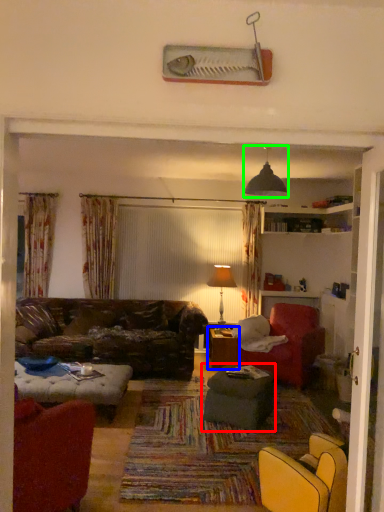
Question: Considering the real-world distances, which object is closest to table (highlighted by a red box)? table (highlighted by a blue box) or light fixture (highlighted by a green box).

Choices:
 (A) table
 (B) light fixture

Answer: (A)